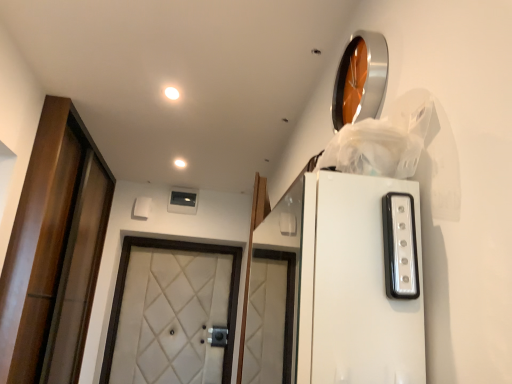
Question: Which direction should I rotate to face matte white light fixture at upper center, the 2th lighting viewed from the back, — up or down?

Choices:
 (A) down
 (B) up

Answer: (B)

Question: Is white glossy light strip at upper right outside of white matte light fixture at upper center, marked as the second lighting in a front-to-back arrangement?

Choices:
 (A) yes
 (B) no

Answer: (A)

Question: From a real-world perspective, is white glossy light strip at upper right physically above white matte light fixture at upper center, the 1th lighting positioned from the bottom?

Choices:
 (A) no
 (B) yes

Answer: (A)

Question: From a real-world perspective, is white glossy light strip at upper right physically below white matte light fixture at upper center, the first lighting from the back?

Choices:
 (A) no
 (B) yes

Answer: (B)

Question: Is the depth of white glossy light strip at upper right greater than that of white matte light fixture at upper center, marked as the second lighting in a front-to-back arrangement?

Choices:
 (A) no
 (B) yes

Answer: (A)

Question: Is white matte light fixture at upper center, the first lighting from the back, inside white glossy light strip at upper right?

Choices:
 (A) yes
 (B) no

Answer: (B)

Question: From the image's perspective, is white glossy light strip at upper right on top of white matte light fixture at upper center, positioned as the second lighting in top-to-bottom order?

Choices:
 (A) yes
 (B) no

Answer: (B)

Question: From a real-world perspective, is white quilted fabric door at center, acting as the second door starting from the left, below matte white light fixture at upper center, the second lighting when ordered from bottom to top?

Choices:
 (A) yes
 (B) no

Answer: (A)

Question: Is there a large distance between white quilted fabric door at center, the first door when ordered from right to left, and matte white light fixture at upper center, the second lighting when ordered from bottom to top?

Choices:
 (A) no
 (B) yes

Answer: (B)

Question: Is the position of white quilted fabric door at center, acting as the second door starting from the left, more distant than that of matte white light fixture at upper center, which is the 1th lighting from front to back?

Choices:
 (A) no
 (B) yes

Answer: (B)

Question: Is white quilted fabric door at center, acting as the second door starting from the left, shorter than matte white light fixture at upper center, which appears as the second lighting when viewed from the left?

Choices:
 (A) no
 (B) yes

Answer: (A)

Question: Is white quilted fabric door at center, the first door when ordered from right to left, located outside matte white light fixture at upper center, the second lighting when ordered from bottom to top?

Choices:
 (A) no
 (B) yes

Answer: (B)

Question: Considering the relative positions of white quilted fabric door at center, acting as the second door starting from the left, and matte white light fixture at upper center, the 2th lighting viewed from the back, in the image provided, is white quilted fabric door at center, acting as the second door starting from the left, to the right of matte white light fixture at upper center, the 2th lighting viewed from the back, from the viewer's perspective?

Choices:
 (A) no
 (B) yes

Answer: (A)

Question: Can you confirm if white matte light fixture at upper center, acting as the 2th lighting starting from the right, is smaller than white glossy light strip at upper right?

Choices:
 (A) yes
 (B) no

Answer: (A)